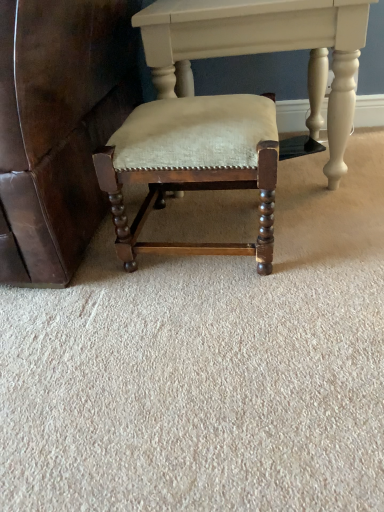
Locate an element on the screen. The height and width of the screenshot is (512, 384). vacant space to the right of matte wood chair at center is located at coordinates (326, 231).